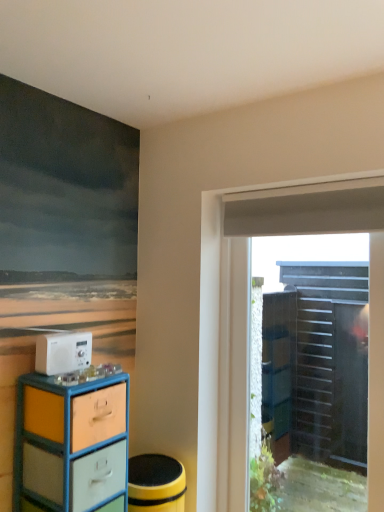
Question: Considering the positions of white plastic radio at lower left and matte plastic chest of drawers at left in the image, is white plastic radio at lower left bigger or smaller than matte plastic chest of drawers at left?

Choices:
 (A) small
 (B) big

Answer: (A)

Question: Is white plastic radio at lower left taller or shorter than matte plastic chest of drawers at left?

Choices:
 (A) tall
 (B) short

Answer: (B)

Question: Which object is positioned closest to the matte plastic chest of drawers at left?

Choices:
 (A) transparent plastic door at right
 (B) white plastic radio at lower left

Answer: (B)

Question: Which of these objects is positioned closest to the transparent plastic door at right?

Choices:
 (A) white plastic radio at lower left
 (B) matte plastic chest of drawers at left

Answer: (B)